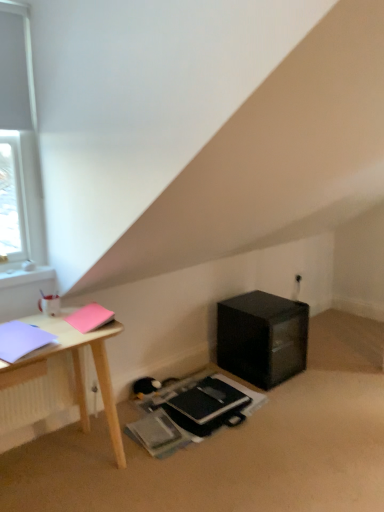
Question: Could you tell me if pink matte notebook at upper left, the second notebook viewed from the front, is turned towards black matte notebook at lower center, which is counted as the 1th notebook, starting from the right?

Choices:
 (A) yes
 (B) no

Answer: (B)

Question: Does pink matte notebook at upper left, which is the 3th notebook from bottom to top, have a greater width compared to black matte notebook at lower center, the third notebook viewed from the left?

Choices:
 (A) no
 (B) yes

Answer: (A)

Question: Is pink matte notebook at upper left, the second notebook viewed from the front, outside of black matte notebook at lower center, which is counted as the 1th notebook, starting from the right?

Choices:
 (A) yes
 (B) no

Answer: (A)

Question: Is pink matte notebook at upper left, the second notebook viewed from the front, to the right of black matte notebook at lower center, which is counted as the 1th notebook, starting from the right, from the viewer's perspective?

Choices:
 (A) no
 (B) yes

Answer: (A)

Question: Does pink matte notebook at upper left, the second notebook viewed from the front, contain black matte notebook at lower center, which is the third notebook in top-to-bottom order?

Choices:
 (A) no
 (B) yes

Answer: (A)

Question: Is black matte notebook at lower center, the third notebook viewed from the left, in front of or behind white matte window at upper left in the image?

Choices:
 (A) behind
 (B) front

Answer: (A)

Question: Is black matte notebook at lower center, which is counted as the 1th notebook, starting from the right, taller or shorter than white matte window at upper left?

Choices:
 (A) short
 (B) tall

Answer: (A)

Question: Is black matte notebook at lower center, placed as the 1th notebook when sorted from back to front, bigger or smaller than white matte window at upper left?

Choices:
 (A) big
 (B) small

Answer: (A)

Question: From the image's perspective, is black matte notebook at lower center, placed as the 1th notebook when sorted from back to front, above or below white matte window at upper left?

Choices:
 (A) above
 (B) below

Answer: (B)

Question: Is matte purple notebook at left, which ranks as the 3th notebook in back-to-front order, taller or shorter than black matte notebook at lower center, the first notebook when ordered from bottom to top?

Choices:
 (A) tall
 (B) short

Answer: (B)

Question: Visually, is matte purple notebook at left, marked as the second notebook in a bottom-to-top arrangement, positioned to the left or to the right of black matte notebook at lower center, placed as the 1th notebook when sorted from back to front?

Choices:
 (A) right
 (B) left

Answer: (B)

Question: Is matte purple notebook at left, which ranks as the 3th notebook in back-to-front order, wider or thinner than black matte notebook at lower center, which appears as the 3th notebook when viewed from the front?

Choices:
 (A) thin
 (B) wide

Answer: (A)

Question: Is matte purple notebook at left, which ranks as the 3th notebook in back-to-front order, inside the boundaries of black matte notebook at lower center, which is the third notebook in top-to-bottom order, or outside?

Choices:
 (A) outside
 (B) inside

Answer: (A)

Question: Choose the correct answer: Is matte purple notebook at left, the 3th notebook from the right, inside pink matte notebook at upper left, the second notebook viewed from the front, or outside it?

Choices:
 (A) inside
 (B) outside

Answer: (B)

Question: Based on their positions, is matte purple notebook at left, the 3th notebook from the right, located to the left or right of pink matte notebook at upper left, positioned as the second notebook in right-to-left order?

Choices:
 (A) left
 (B) right

Answer: (A)